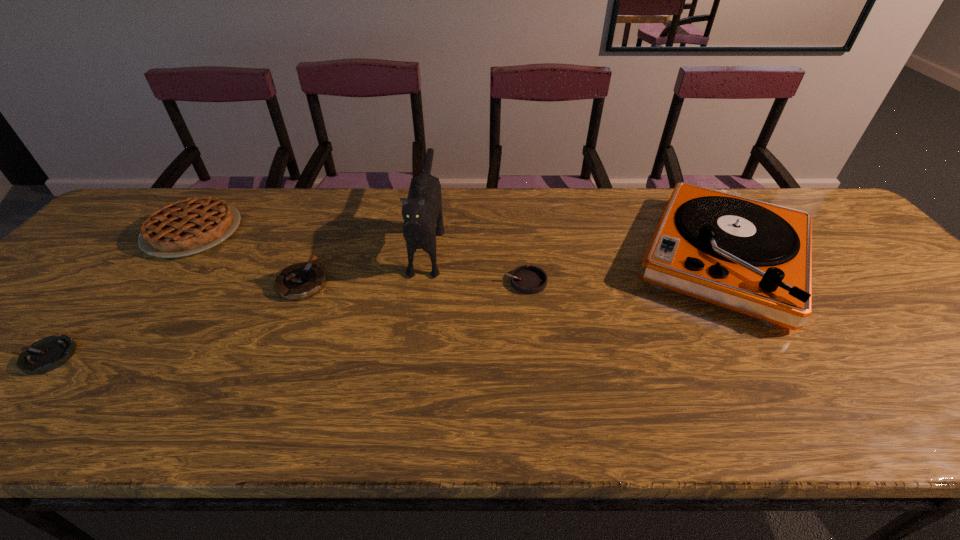
You are a GUI agent. You are given a task and a screenshot of the screen. Output one action in this format:
    pyautogui.click(x=<x>, y=<y>)
    Task: Click on the free space between the leftmost ashtray and the third tallest object
    
    Given the screenshot: What is the action you would take?
    pyautogui.click(x=121, y=294)

I want to click on vacant area that lies between the rightmost object and the fourth shortest object, so click(x=458, y=245).

Where is `vacant area that lies between the fifth tallest object and the shortest ashtray`? The width and height of the screenshot is (960, 540). vacant area that lies between the fifth tallest object and the shortest ashtray is located at coordinates 287,319.

The height and width of the screenshot is (540, 960). What are the coordinates of `vacant area that lies between the cat and the rightmost ashtray` in the screenshot? It's located at (477, 259).

Image resolution: width=960 pixels, height=540 pixels. In order to click on free space between the second tallest ashtray and the shortest object in this screenshot , I will do `click(287, 319)`.

Locate an element on the screen. Image resolution: width=960 pixels, height=540 pixels. vacant space in between the fourth tallest object and the nearest ashtray is located at coordinates (176, 320).

Where is `vacant area between the second ashtray from left to right and the pie`? The height and width of the screenshot is (540, 960). vacant area between the second ashtray from left to right and the pie is located at coordinates pos(248,257).

Identify the location of vacant space that is in between the fourth object from right to left and the second shortest object. The height and width of the screenshot is (540, 960). (x=414, y=282).

Identify which object is the fifth closest to the third tallest object. Please provide its 2D coordinates. Your answer should be formatted as a tuple, i.e. [(x, y)], where the tuple contains the x and y coordinates of a point satisfying the conditions above.

[(753, 257)]

Image resolution: width=960 pixels, height=540 pixels. Identify the location of object that can be found as the second closest to the tallest ashtray. (422, 210).